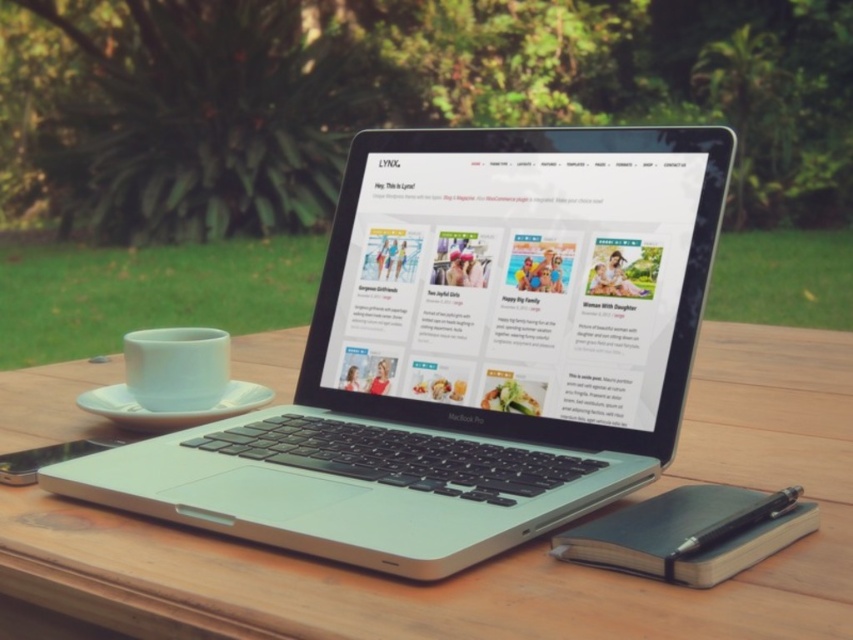
Which is more to the left, white matte saucer at lower left or satin silver macbook pro at center?

Positioned to the left is white matte saucer at lower left.

This screenshot has width=853, height=640. What do you see at coordinates (170, 412) in the screenshot? I see `white matte saucer at lower left` at bounding box center [170, 412].

Where is `white matte saucer at lower left`? The height and width of the screenshot is (640, 853). white matte saucer at lower left is located at coordinates (170, 412).

Which of these two, wooden table at center or white matte saucer at lower left, stands taller?

Standing taller between the two is wooden table at center.

Between wooden table at center and white matte saucer at lower left, which one has less height?

With less height is white matte saucer at lower left.

Which is in front, point (109, 620) or point (229, 392)?

Point (109, 620) is in front.

Where is `wooden table at center`? This screenshot has height=640, width=853. wooden table at center is located at coordinates (500, 556).

Which of these two, wooden table at center or satin silver macbook pro at center, stands taller?

wooden table at center

Can you confirm if wooden table at center is positioned below satin silver macbook pro at center?

Correct, wooden table at center is located below satin silver macbook pro at center.

Is point (299, 561) closer to camera compared to point (482, 420)?

That is True.

What are the coordinates of `wooden table at center` in the screenshot? It's located at (500, 556).